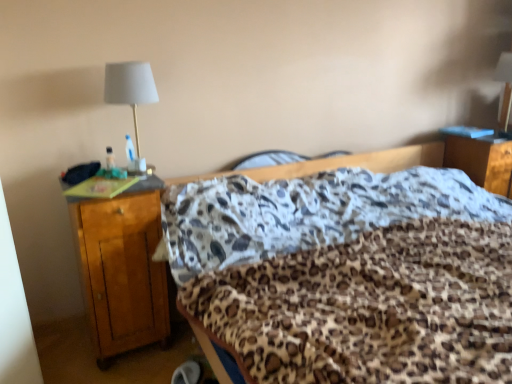
Question: Does wooden nightstand at lower right, which is counted as the 2th nightstand, starting from the front, have a greater height compared to leopard print fabric at center?

Choices:
 (A) no
 (B) yes

Answer: (A)

Question: Can you confirm if wooden nightstand at lower right, which is counted as the 2th nightstand, starting from the front, is shorter than leopard print fabric at center?

Choices:
 (A) yes
 (B) no

Answer: (A)

Question: Is wooden nightstand at lower right, the 1th nightstand when ordered from right to left, outside of leopard print fabric at center?

Choices:
 (A) yes
 (B) no

Answer: (A)

Question: Does wooden nightstand at lower right, the 1th nightstand when ordered from right to left, have a smaller size compared to leopard print fabric at center?

Choices:
 (A) yes
 (B) no

Answer: (A)

Question: Does wooden nightstand at lower right, the second nightstand positioned from the left, come behind leopard print fabric at center?

Choices:
 (A) no
 (B) yes

Answer: (B)

Question: Relative to matte white lampshade at upper left, is wooden nightstand at lower right, the second nightstand positioned from the left, in front or behind?

Choices:
 (A) behind
 (B) front

Answer: (A)

Question: Is point (474, 168) positioned closer to the camera than point (122, 104)?

Choices:
 (A) farther
 (B) closer

Answer: (A)

Question: Is wooden nightstand at lower right, the second nightstand positioned from the left, inside the boundaries of matte white lampshade at upper left, or outside?

Choices:
 (A) outside
 (B) inside

Answer: (A)

Question: In terms of width, does wooden nightstand at lower right, which is counted as the 2th nightstand, starting from the front, look wider or thinner when compared to matte white lampshade at upper left?

Choices:
 (A) wide
 (B) thin

Answer: (A)

Question: Is matte white lampshade at upper left bigger or smaller than wooden nightstand at lower right, the 1th nightstand when ordered from right to left?

Choices:
 (A) big
 (B) small

Answer: (B)

Question: Is matte white lampshade at upper left wider or thinner than wooden nightstand at lower right, the 1th nightstand positioned from the back?

Choices:
 (A) thin
 (B) wide

Answer: (A)

Question: Would you say matte white lampshade at upper left is to the left or to the right of wooden nightstand at lower right, the second nightstand positioned from the left, in the picture?

Choices:
 (A) right
 (B) left

Answer: (B)

Question: Relative to wooden nightstand at lower right, the 1th nightstand positioned from the back, is matte white lampshade at upper left in front or behind?

Choices:
 (A) behind
 (B) front

Answer: (B)

Question: From the image's perspective, is leopard print fabric at center above or below wooden nightstand at left, the 1th nightstand in the front-to-back sequence?

Choices:
 (A) above
 (B) below

Answer: (B)

Question: From a real-world perspective, is leopard print fabric at center physically located above or below wooden nightstand at left, which is the second nightstand in right-to-left order?

Choices:
 (A) above
 (B) below

Answer: (B)